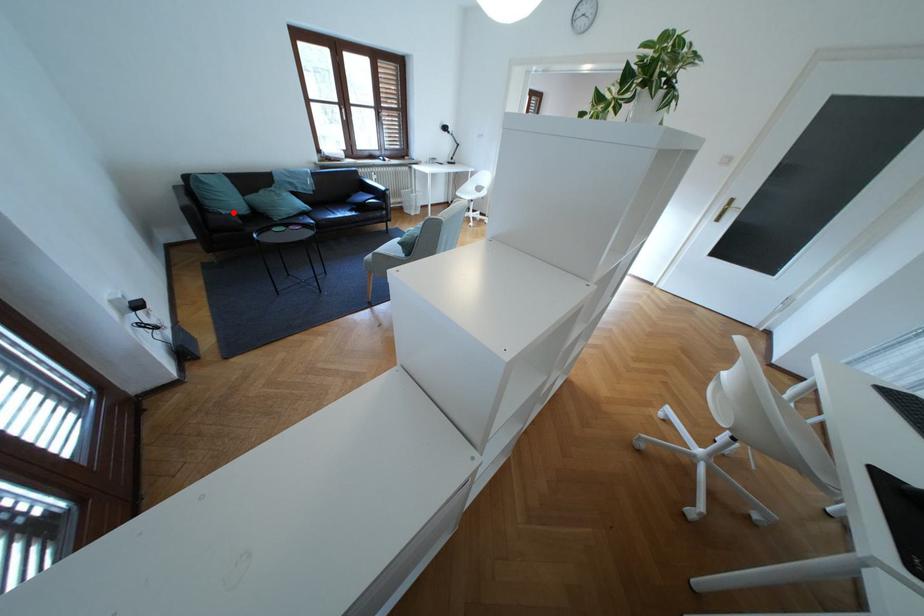
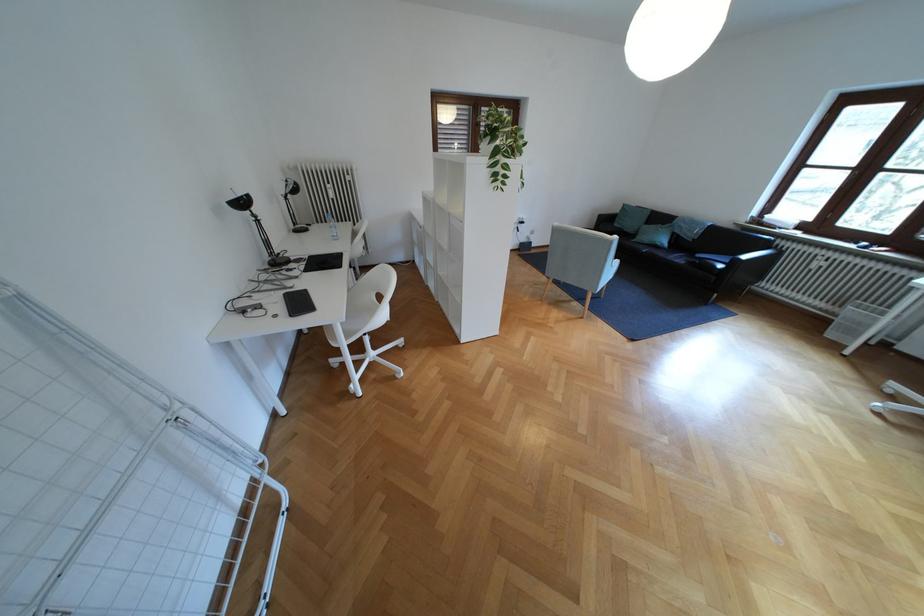
Question: A red point is marked in image1. In image2, is the corresponding 3D point closer to the camera or farther? Reply with the corresponding letter.

Choices:
 (A) The corresponding 3D point is closer.
 (B) The corresponding 3D point is farther.

Answer: (B)